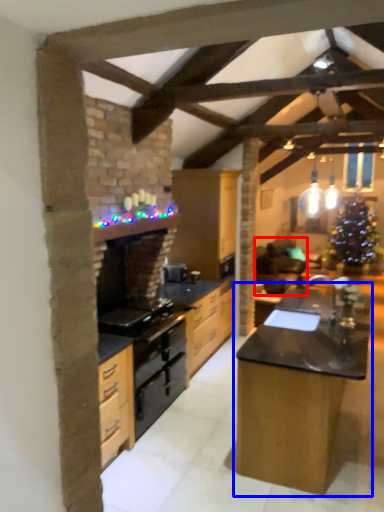
Question: Which point is further to the camera, armchair (highlighted by a red box) or table (highlighted by a blue box)?

Choices:
 (A) armchair
 (B) table

Answer: (A)